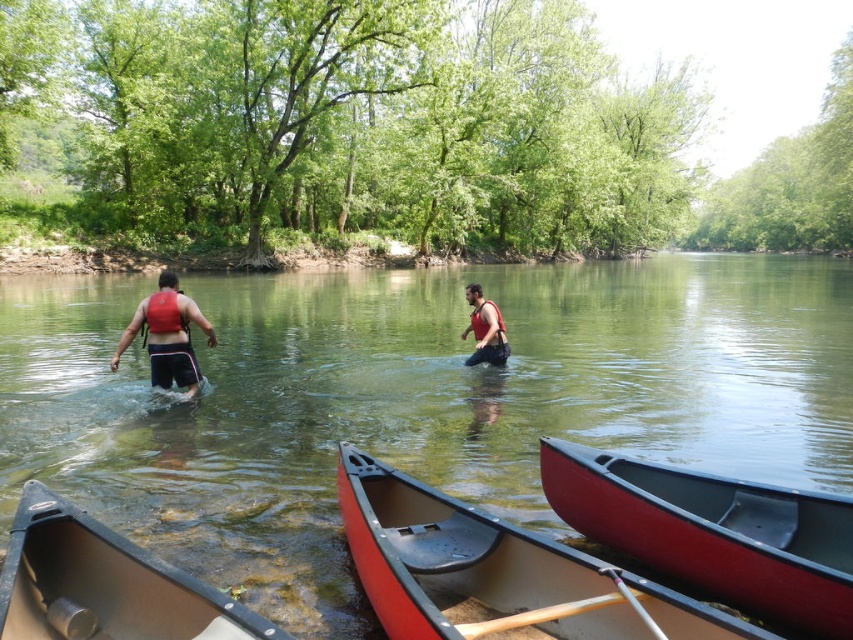
Question: Is wooden paddle at lower center to the left of matte red life vest at center from the viewer's perspective?

Choices:
 (A) yes
 (B) no

Answer: (A)

Question: Which point is closer to the camera?

Choices:
 (A) red matte life vest at left
 (B) shiny red canoe at lower center

Answer: (B)

Question: Does shiny red canoe at lower center have a larger size compared to matte red life vest at center?

Choices:
 (A) yes
 (B) no

Answer: (A)

Question: Which object is closer to the camera taking this photo?

Choices:
 (A) matte red life vest at center
 (B) black matte canoe at lower left
 (C) matte red canoe at lower center

Answer: (C)

Question: Where is matte red canoe at lower center located in relation to matte red life vest at center in the image?

Choices:
 (A) left
 (B) right

Answer: (A)

Question: Among these objects, which one is nearest to the camera?

Choices:
 (A) red matte life vest at left
 (B) matte red life vest at center

Answer: (A)